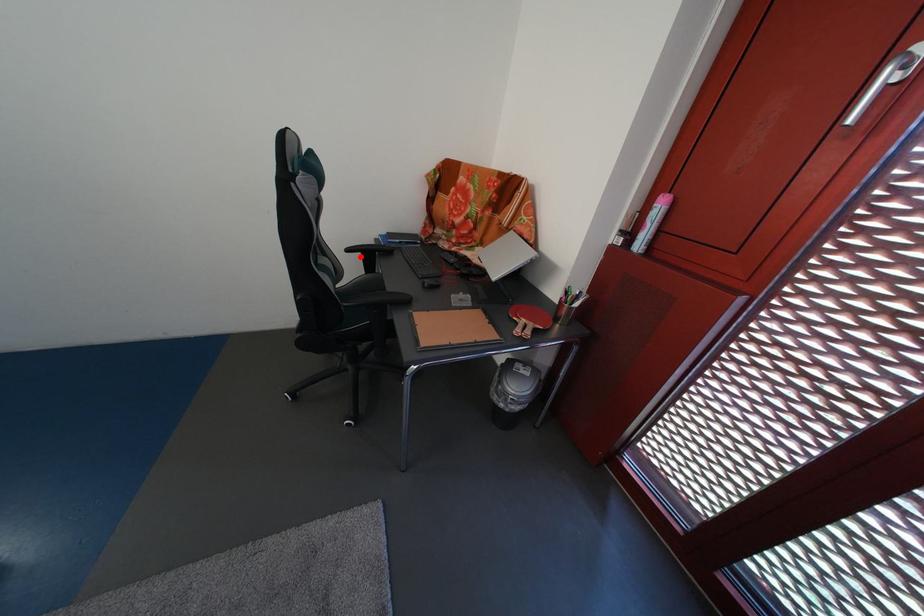
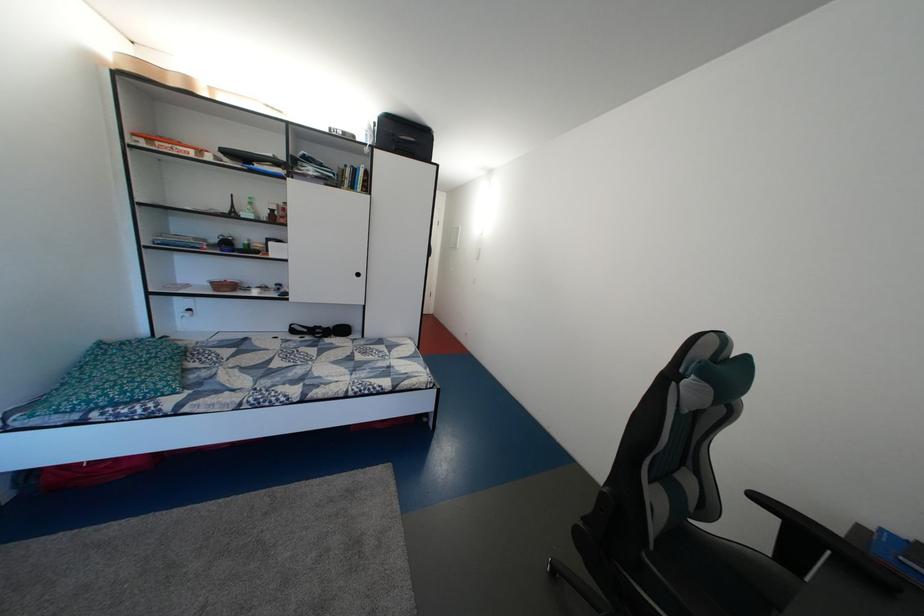
Locate, in the second image, the point that corresponds to the highlighted location in the first image.

(768, 504)